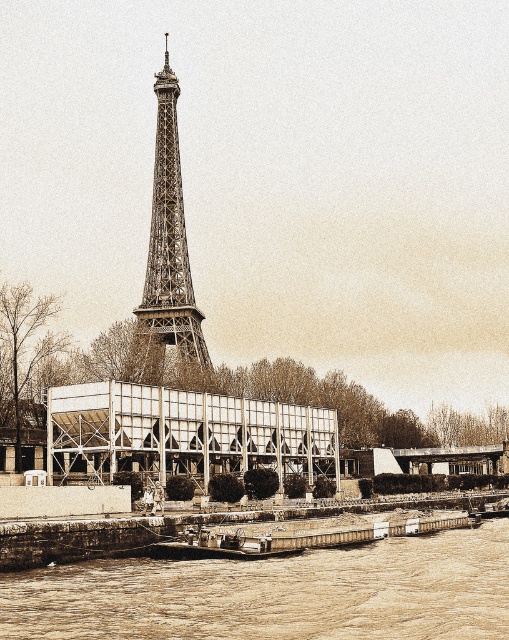
Between brown sedimentary river at lower center and metallic lattice tower at center, which one appears on the left side from the viewer's perspective?

metallic lattice tower at center

Who is taller, brown sedimentary river at lower center or metallic lattice tower at center?

metallic lattice tower at center

Find the location of a particular element. The width and height of the screenshot is (509, 640). brown sedimentary river at lower center is located at coordinates (275, 593).

Which is above, metallic lattice tower at center or rustic wood boat at lower center?

metallic lattice tower at center is above.

Does metallic lattice tower at center appear on the left side of rustic wood boat at lower center?

Correct, you'll find metallic lattice tower at center to the left of rustic wood boat at lower center.

Which is in front, point (173, 209) or point (200, 548)?

Point (200, 548) is in front.

This screenshot has width=509, height=640. Identify the location of metallic lattice tower at center. (168, 268).

Can you confirm if brown sedimentary river at lower center is positioned to the right of rustic wood boat at lower center?

Yes, brown sedimentary river at lower center is to the right of rustic wood boat at lower center.

Which is below, brown sedimentary river at lower center or rustic wood boat at lower center?

brown sedimentary river at lower center

Who is more forward, (370,616) or (237,556)?

Point (370,616) is in front.

You are a GUI agent. You are given a task and a screenshot of the screen. Output one action in this format:
    pyautogui.click(x=<x>, y=<y>)
    Task: Click on the brown sedimentary river at lower center
    This screenshot has width=509, height=640.
    Given the screenshot: What is the action you would take?
    pyautogui.click(x=275, y=593)